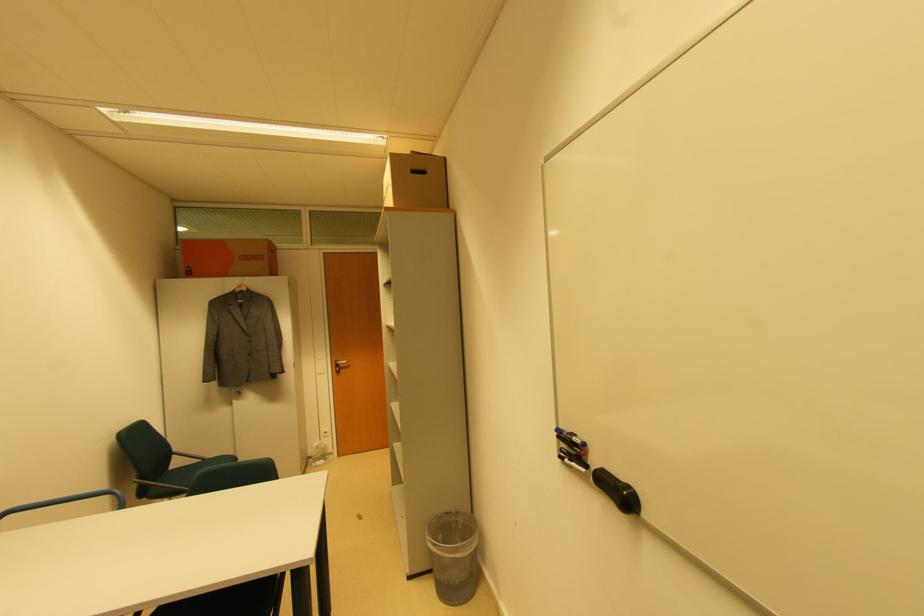
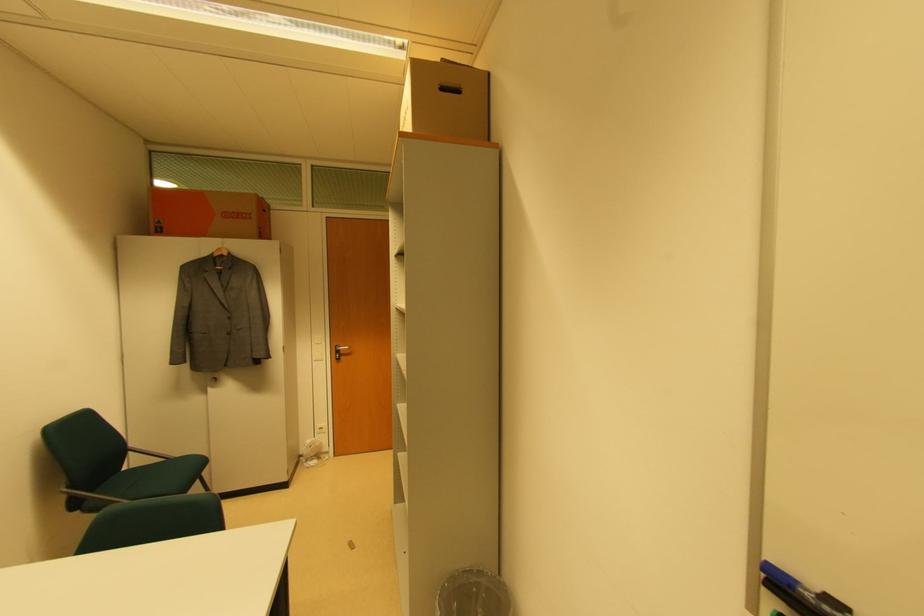
Where in the second image is the point corresponding to (x=172, y=471) from the first image?

(126, 471)